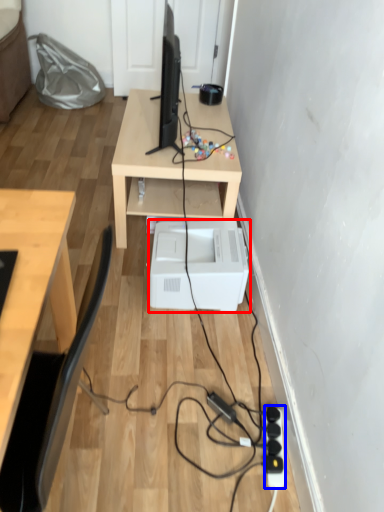
Question: Which object is further to the camera taking this photo, printer (highlighted by a red box) or extension cord (highlighted by a blue box)?

Choices:
 (A) printer
 (B) extension cord

Answer: (A)